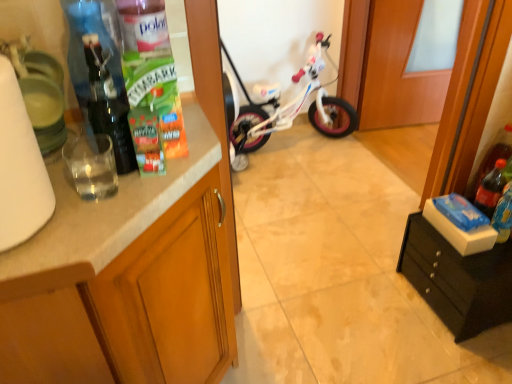
Identify the location of vacant space in front of black matte drawer at lower right, positioned as the second cabinetry in left-to-right order. This screenshot has height=384, width=512. (461, 355).